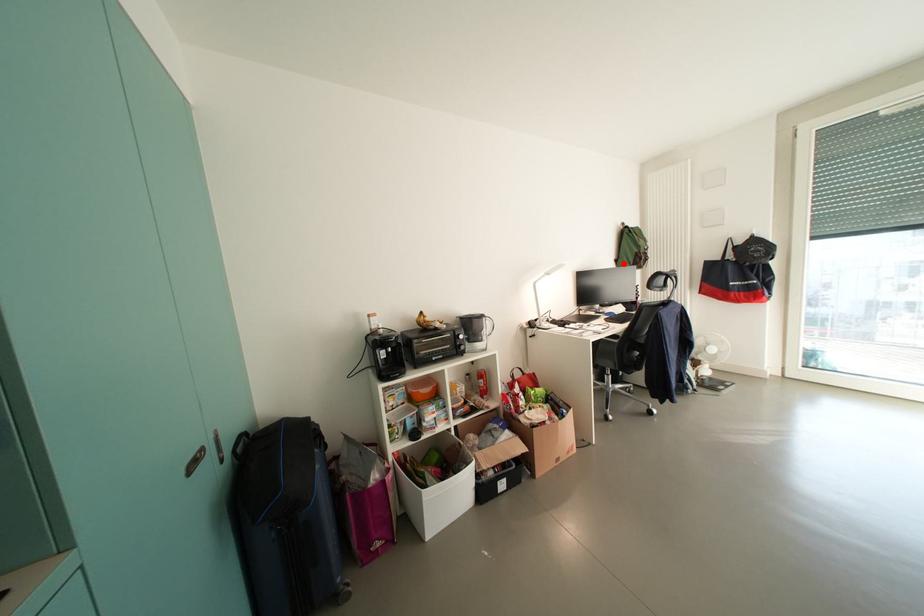
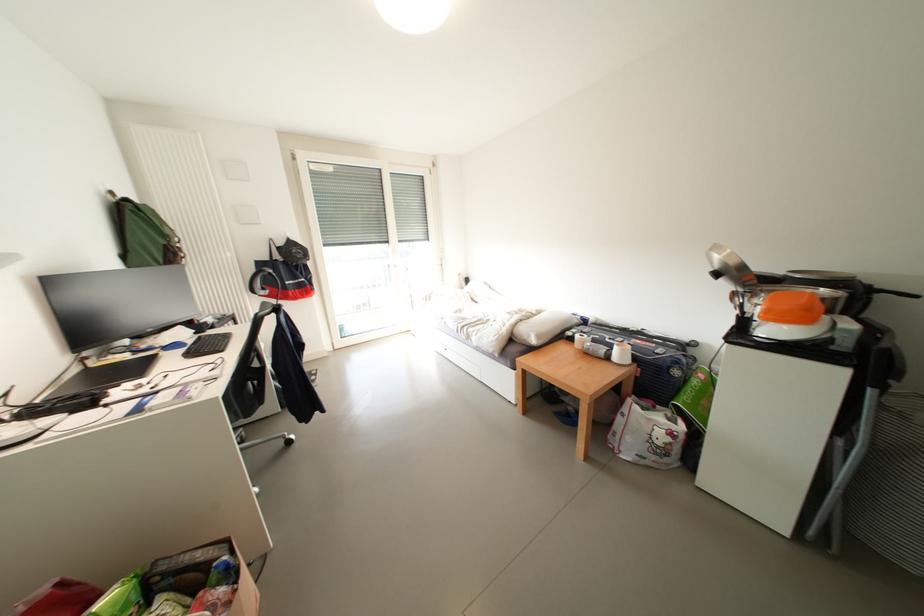
Locate, in the second image, the point that corresponds to the highlighted location in the first image.

(131, 259)